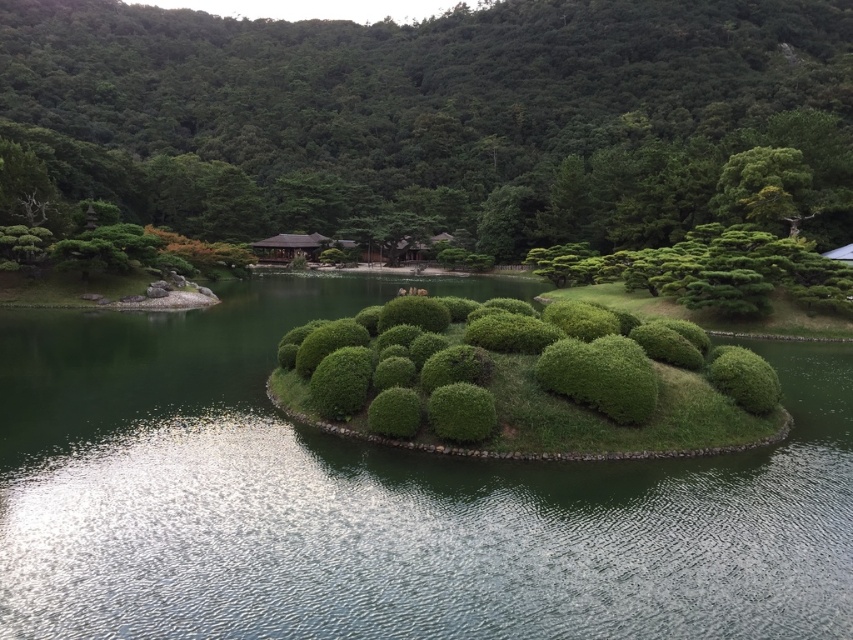
Find the location of a particular element. The height and width of the screenshot is (640, 853). green grassy island at center is located at coordinates (380, 500).

Does point (701, 461) lie behind point (561, 449)?

That is True.

Find the location of a particular element. This screenshot has height=640, width=853. green grassy island at center is located at coordinates (380, 500).

Which is below, green leafy bush at center or green bushy hedge at center?

Positioned lower is green bushy hedge at center.

Who is positioned more to the right, green leafy bush at center or green bushy hedge at center?

Positioned to the right is green bushy hedge at center.

Between point (228, 52) and point (363, 337), which one is positioned in front?

Point (363, 337) is more forward.

Identify the location of green leafy bush at center. (436, 115).

Which is in front, point (56, 490) or point (73, 104)?

Point (56, 490) is in front.

Which is above, green grassy island at center or green leafy bush at center?

green leafy bush at center

The image size is (853, 640). What do you see at coordinates (380, 500) in the screenshot? I see `green grassy island at center` at bounding box center [380, 500].

Identify the location of green grassy island at center. [380, 500].